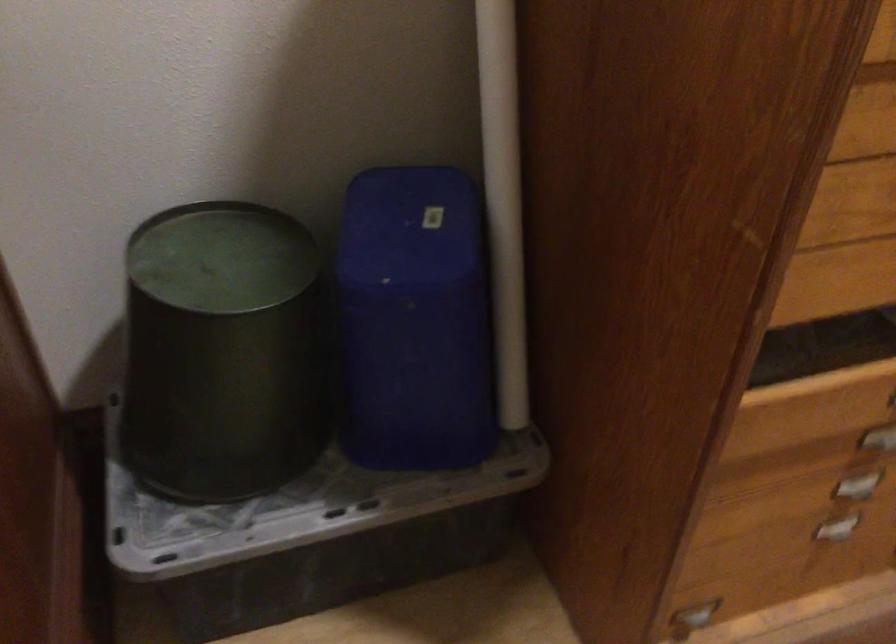
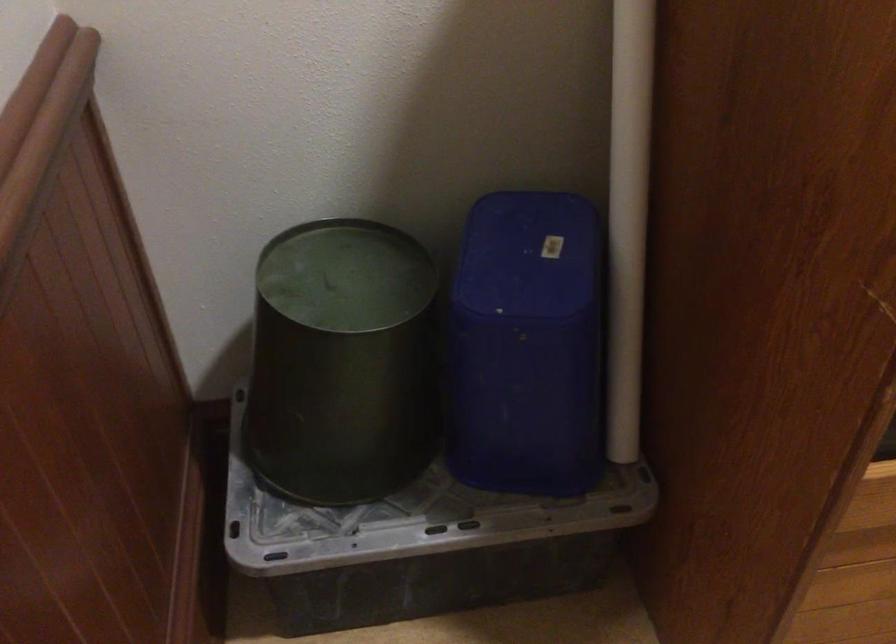
Question: The camera is either moving clockwise (left) or counter-clockwise (right) around the object. The first image is from the beginning of the video and the second image is from the end. Is the camera moving left or right when shooting the video?

Choices:
 (A) Left
 (B) Right

Answer: (B)